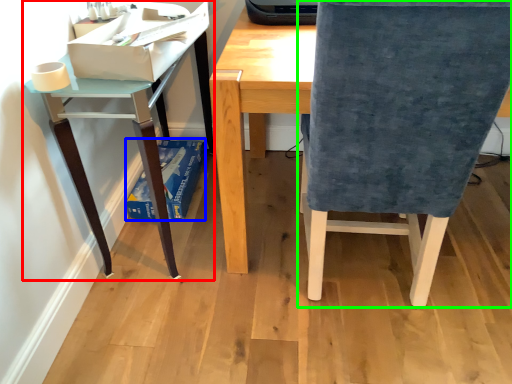
Question: Which object is positioned farthest from table (highlighted by a red box)? Select from paperback book (highlighted by a blue box) and chair (highlighted by a green box).

Choices:
 (A) paperback book
 (B) chair

Answer: (B)